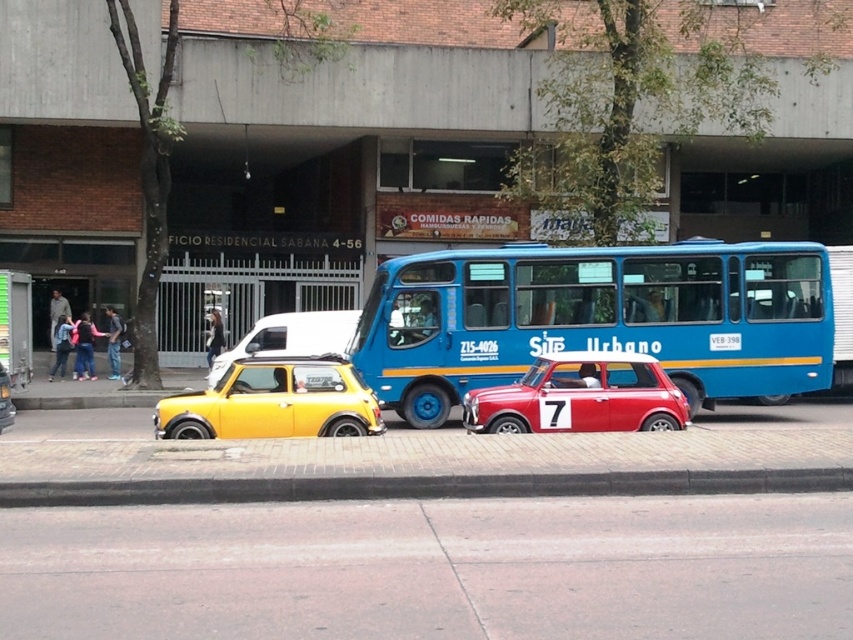
Question: Is yellow matte hatchback at center positioned before yellow matte car at center?

Choices:
 (A) yes
 (B) no

Answer: (B)

Question: Which of the following is the farthest from the observer?

Choices:
 (A) yellow matte car at center
 (B) shiny red car at center

Answer: (A)

Question: From the image, what is the correct spatial relationship of brick at lower center in relation to yellow matte car at center?

Choices:
 (A) above
 (B) below

Answer: (B)

Question: Is brick at lower center to the left of shiny red car at center from the viewer's perspective?

Choices:
 (A) yes
 (B) no

Answer: (A)

Question: Which of the following is the farthest from the observer?

Choices:
 (A) yellow matte hatchback at center
 (B) brick at lower center
 (C) yellow matte car at center
 (D) blue metallic bus at center

Answer: (A)

Question: Which object appears closest to the camera in this image?

Choices:
 (A) yellow matte hatchback at center
 (B) brick at lower center
 (C) blue metallic bus at center

Answer: (B)